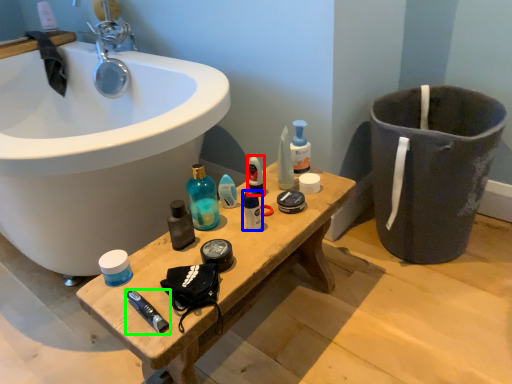
Question: Estimate the real-world distances between objects in this image. Which object is closer to mouthwash (highlighted by a red box), toiletry (highlighted by a blue box) or toothpaste (highlighted by a green box)?

Choices:
 (A) toiletry
 (B) toothpaste

Answer: (A)